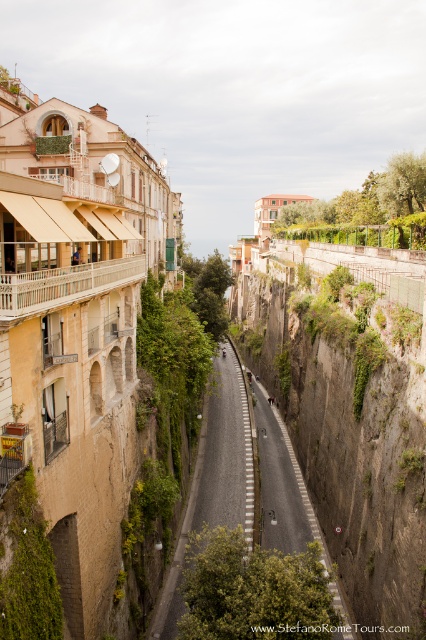
Between point (379, 600) and point (238, 412), which one is positioned in front?

Positioned in front is point (379, 600).

Measure the distance between brown rough cliff at center and asphalt road at center.

They are 25.27 meters apart.

Is point (368, 524) positioned behind point (232, 467)?

No, it is in front of (232, 467).

This screenshot has height=640, width=426. I want to click on brown rough cliff at center, so click(x=350, y=412).